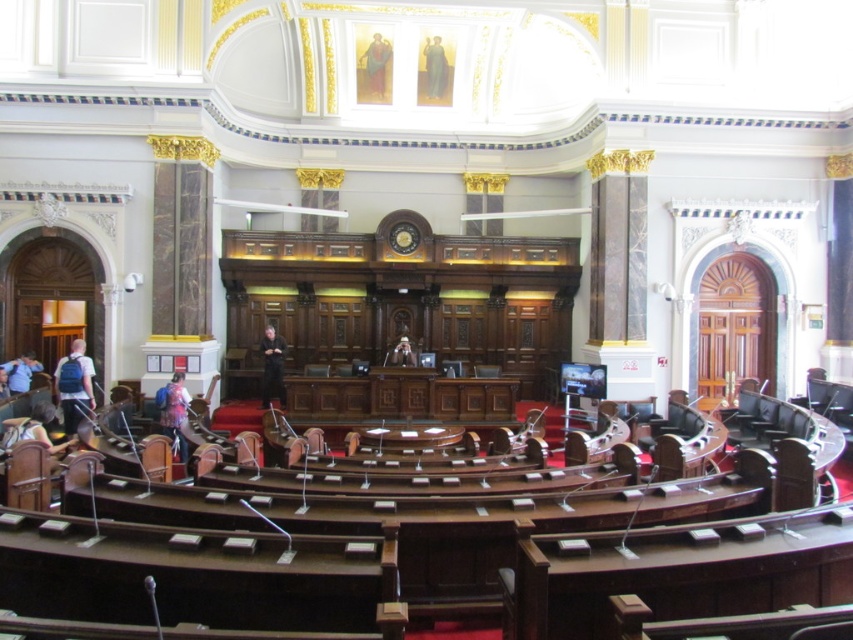
Does denim jacket at lower left have a larger size compared to blue fabric figure at upper center?

Indeed, denim jacket at lower left has a larger size compared to blue fabric figure at upper center.

Is point (184, 454) positioned behind point (422, 52)?

No, it is in front of (422, 52).

Is point (181, 385) positioned before point (436, 52)?

Yes, point (181, 385) is closer to viewer.

This screenshot has width=853, height=640. Find the location of `denim jacket at lower left`. denim jacket at lower left is located at coordinates (173, 412).

Is denim jacket at lower left to the left of blue backpack at left from the viewer's perspective?

No, denim jacket at lower left is not to the left of blue backpack at left.

Does denim jacket at lower left appear under blue backpack at left?

Indeed, denim jacket at lower left is positioned under blue backpack at left.

Locate an element on the screen. The image size is (853, 640). denim jacket at lower left is located at coordinates (173, 412).

Is matte blue backpack at left thinner than blue fabric figure at upper center?

Correct, matte blue backpack at left's width is less than blue fabric figure at upper center's.

Between matte blue backpack at left and blue fabric figure at upper center, which one appears on the right side from the viewer's perspective?

blue fabric figure at upper center is more to the right.

Is point (71, 406) farther from camera compared to point (434, 42)?

No, it is not.

I want to click on matte blue backpack at left, so click(x=74, y=387).